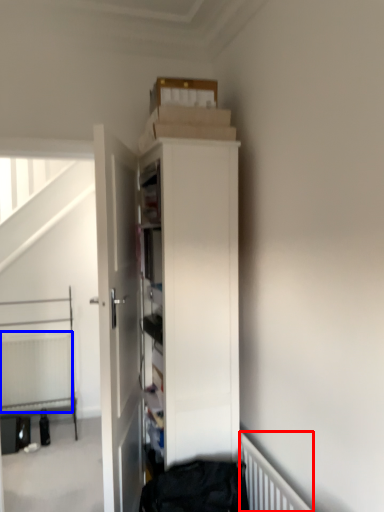
Question: Which of the following is the closest to the observer, radiator (highlighted by a red box) or radiator (highlighted by a blue box)?

Choices:
 (A) radiator
 (B) radiator

Answer: (A)